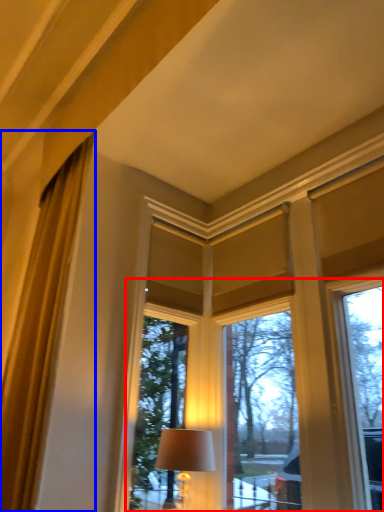
Question: Which object is closer to the camera taking this photo, bay window (highlighted by a red box) or curtain (highlighted by a blue box)?

Choices:
 (A) bay window
 (B) curtain

Answer: (B)